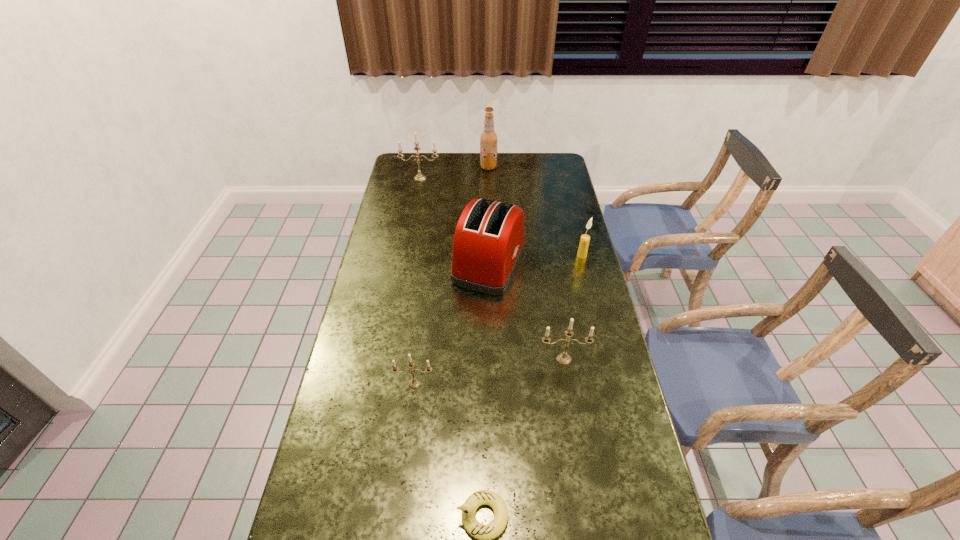
Locate an element on the screen. The height and width of the screenshot is (540, 960). vacant space that satisfies the following two spatial constraints: 1. on the back side of the second farthest candle; 2. on the front label of the tallest object is located at coordinates (560, 167).

Where is `free space in the image that satisfies the following two spatial constraints: 1. on the back side of the third nearest candle; 2. on the left side of the nearest metallic candle`? This screenshot has width=960, height=540. free space in the image that satisfies the following two spatial constraints: 1. on the back side of the third nearest candle; 2. on the left side of the nearest metallic candle is located at coordinates (430, 255).

At what (x,y) coordinates should I click in order to perform the action: click on vacant area that satisfies the following two spatial constraints: 1. on the front side of the farthest candle; 2. on the right side of the cream candle. Please return your answer as a coordinate pair (x, y). Looking at the image, I should click on (406, 255).

The image size is (960, 540). I want to click on vacant space that satisfies the following two spatial constraints: 1. on the front label of the sixth object from left to right; 2. on the right side of the tallest object, so click(493, 359).

Where is `vacant space that satisfies the following two spatial constraints: 1. on the front label of the rightmost metallic candle; 2. on the right side of the beer bottle`? The width and height of the screenshot is (960, 540). vacant space that satisfies the following two spatial constraints: 1. on the front label of the rightmost metallic candle; 2. on the right side of the beer bottle is located at coordinates (493, 359).